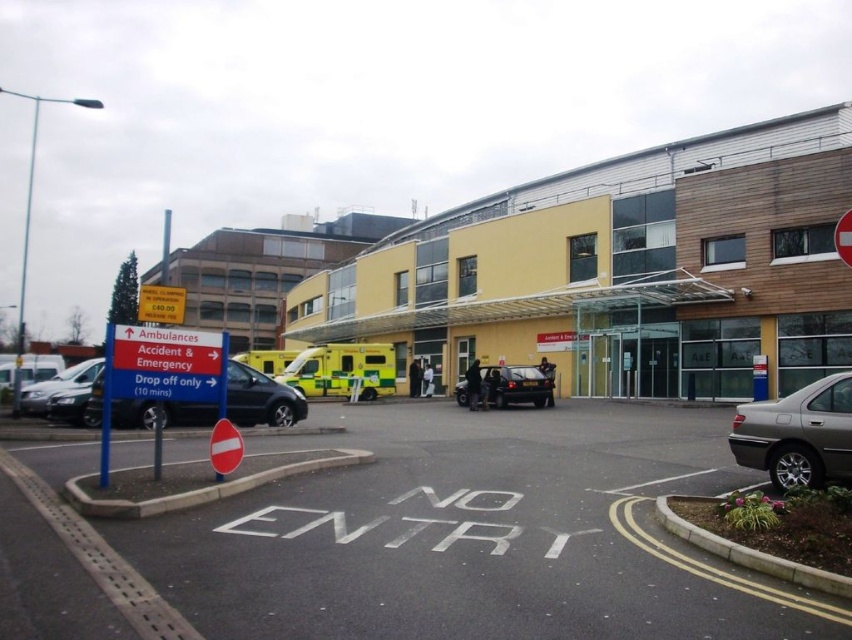
Which is below, silver metallic sedan at lower right or yellow-green plastic ambulance at center?

silver metallic sedan at lower right

Could you measure the distance between silver metallic sedan at lower right and yellow-green plastic ambulance at center?

silver metallic sedan at lower right and yellow-green plastic ambulance at center are 67.45 feet apart from each other.

I want to click on silver metallic sedan at lower right, so click(x=797, y=435).

From the picture: Is the position of black metallic van at left more distant than that of yellow plastic sign at upper center?

Yes.

Does point (255, 420) lie in front of point (156, 308)?

No, it is not.

Is point (245, 380) less distant than point (165, 307)?

No, (245, 380) is behind (165, 307).

Image resolution: width=852 pixels, height=640 pixels. In order to click on black metallic van at left in this screenshot , I will do `click(260, 397)`.

Can you confirm if yellow-green plastic ambulance at center is positioned above black glossy car at center?

Indeed, yellow-green plastic ambulance at center is positioned over black glossy car at center.

Between yellow-green plastic ambulance at center and black glossy car at center, which one appears on the right side from the viewer's perspective?

Positioned to the right is black glossy car at center.

Between point (360, 396) and point (458, 397), which one is positioned in front?

Point (458, 397) is in front.

Where is `yellow-green plastic ambulance at center`? yellow-green plastic ambulance at center is located at coordinates coord(343,371).